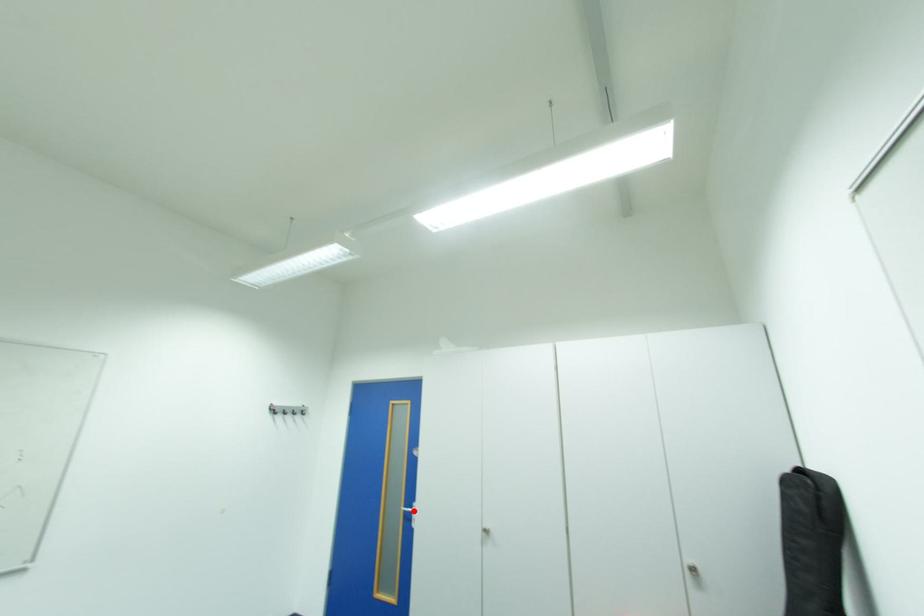
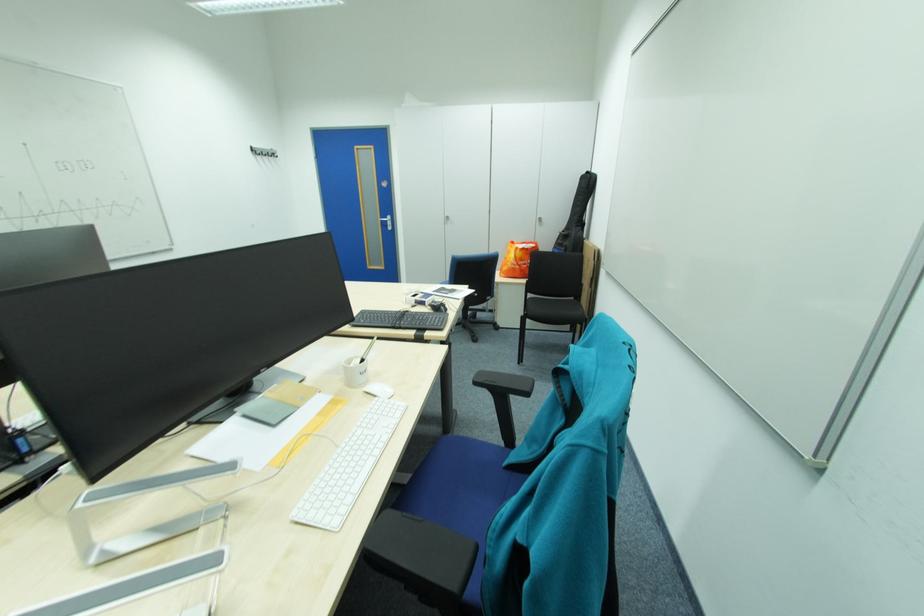
Question: I am providing you with two images of the same scene from different viewpoints. Image1 has a red point marked. In image2, the corresponding 3D location appears at what relative position? Reply with the corresponding letter.

Choices:
 (A) Closer
 (B) Farther

Answer: (A)